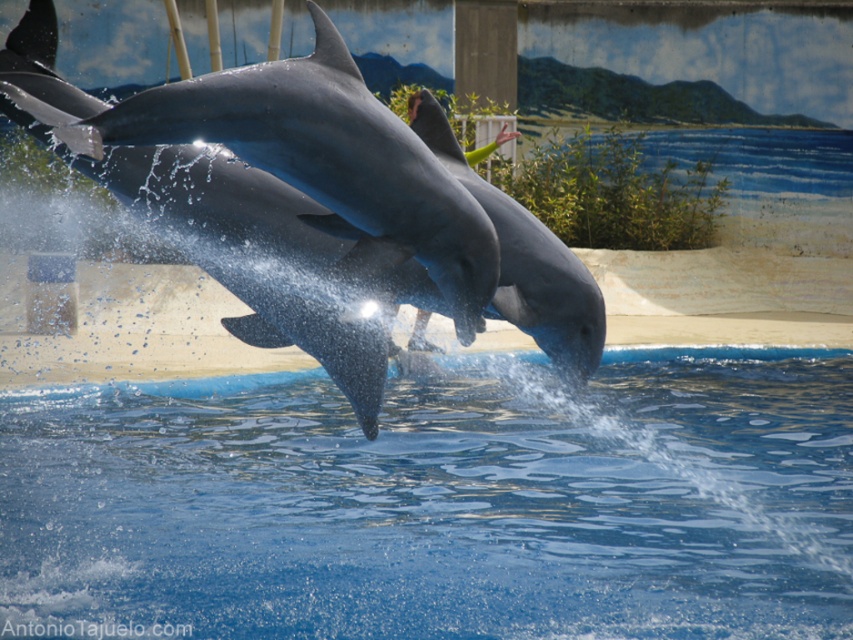
You are a photographer trying to capture the dolphins in the marine park. You notice the blue smooth water at center and the shiny gray dolphin at center. Which one appears larger in the image?

The shiny gray dolphin at center appears larger than the blue smooth water at center in the image.

You are standing at the edge of the pool and want to aim a water cannon at the blue smooth water at center. What are the coordinates you should target?

The coordinates for the blue smooth water at center are at point (438, 508), so aim the water cannon at those coordinates.

You are a photographer positioned at the edge of the pool. You want to capture a photo where the gray smooth dolphin at center is clearly visible in front of the blue smooth water at center. Is this possible based on their positions?

The blue smooth water at center is in front of the gray smooth dolphin at center, so the dolphin would appear behind the water in the photo, making it less visible. To have the dolphin in front, you might need to adjust your angle or position.